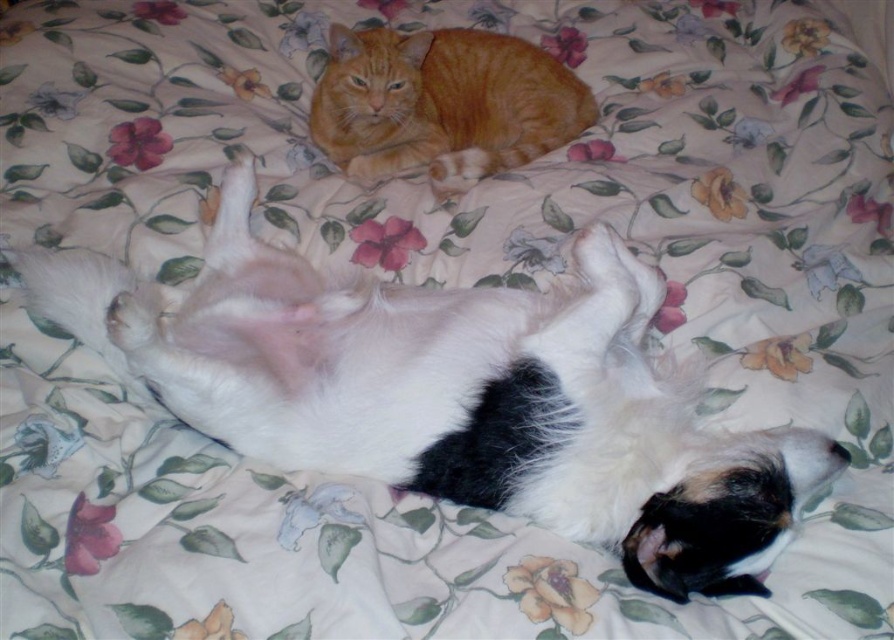
You are a photographer trying to capture both cats in a single shot. Since both are at upper center, which cat should you adjust your camera to focus on first if you want to ensure the white soft fur cat at upper center is in the frame before the orange fur cat at upper center?

You should focus on the white soft fur cat at upper center first because it is positioned to the left of the orange fur cat at upper center, so adjusting the camera to the left side of the upper center area will capture it first.

You are a photographer trying to capture both cats in one frame. Given that your camera has a 12.00 inch focus range, can you fit both the white soft fur cat at upper center and the orange fur cat at upper center into the frame without moving the camera?

The white soft fur cat at upper center and orange fur cat at upper center are 16.00 inches apart from each other. Since the camera has a 12.00 inch focus range, the distance between them exceeds the camera range. Therefore, you cannot fit both cats into the frame without moving the camera.